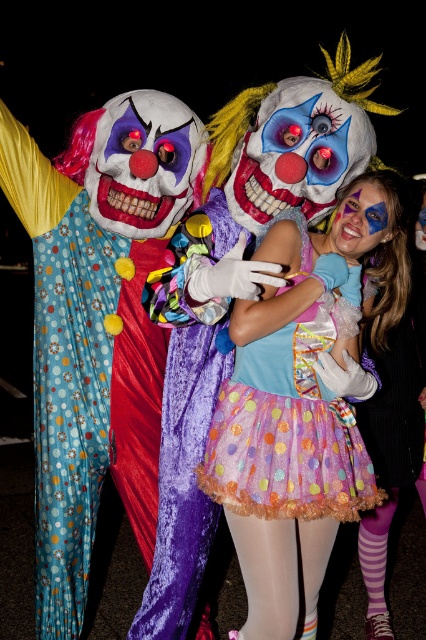
Is polka dot fabric clown at left to the left of pastel polka dot tutu at center from the viewer's perspective?

Indeed, polka dot fabric clown at left is positioned on the left side of pastel polka dot tutu at center.

Between point (178, 198) and point (317, 504), which one is positioned in front?

Point (317, 504)

Find the location of a particular element. This screenshot has height=640, width=426. polka dot fabric clown at left is located at coordinates (97, 323).